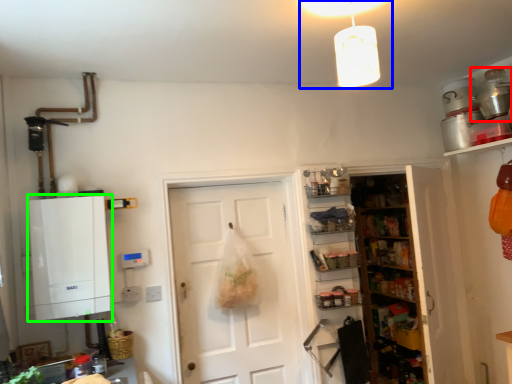
Question: Which object is the closest to the appliance (highlighted by a red box)? Choose among these: light fixture (highlighted by a blue box) or cabinetry (highlighted by a green box).

Choices:
 (A) light fixture
 (B) cabinetry

Answer: (A)